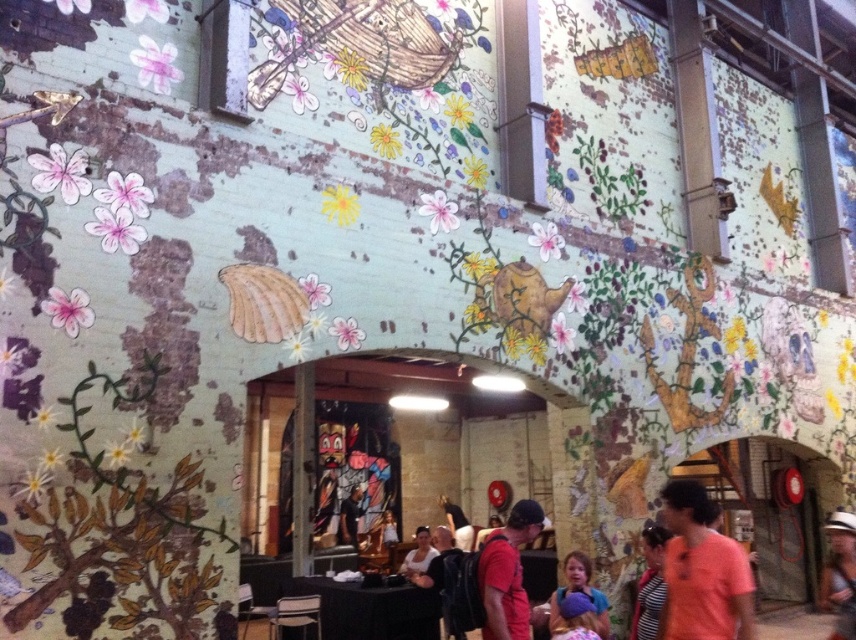
Question: Among these objects, which one is farthest from the camera?

Choices:
 (A) dark brown leather jacket at center
 (B) white matte hat at lower right

Answer: (A)

Question: Can you confirm if matte pink shirt at center is positioned below striped shirt at center?

Choices:
 (A) no
 (B) yes

Answer: (A)

Question: Does matte pink shirt at center appear under striped shirt at center?

Choices:
 (A) no
 (B) yes

Answer: (A)

Question: Which of these objects is positioned farthest from the matte pink shirt at center?

Choices:
 (A) matte purple shirt at center
 (B) matte red shirt at lower center
 (C) striped shirt at center
 (D) white matte hat at lower right

Answer: (D)

Question: Is matte pink shirt at center positioned before dark brown leather jacket at center?

Choices:
 (A) no
 (B) yes

Answer: (B)

Question: Which point is farther from the camera taking this photo?

Choices:
 (A) (406, 563)
 (B) (733, 612)
 (C) (829, 593)
 (D) (346, 497)

Answer: (D)